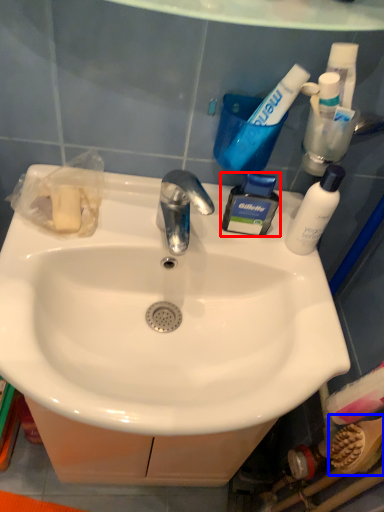
Question: Which object is further to the camera taking this photo, toiletry (highlighted by a red box) or brush (highlighted by a blue box)?

Choices:
 (A) toiletry
 (B) brush

Answer: (A)